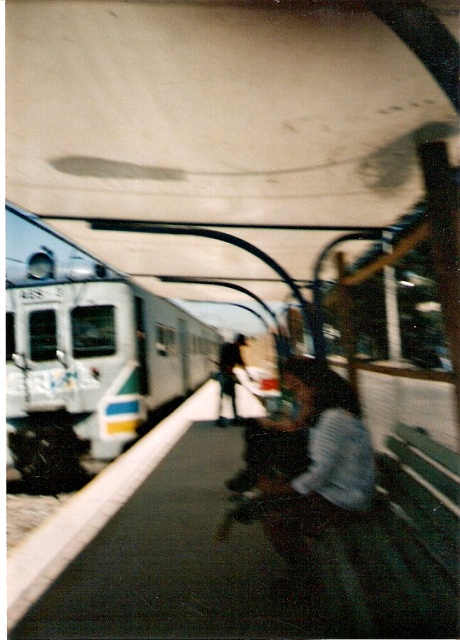
You are a passenger waiting at the subway station. You see a silver metallic train at left and dark blue jeans at center. Which object is closer to you?

The silver metallic train at left is closer to you because it is in front of the dark blue jeans at center.